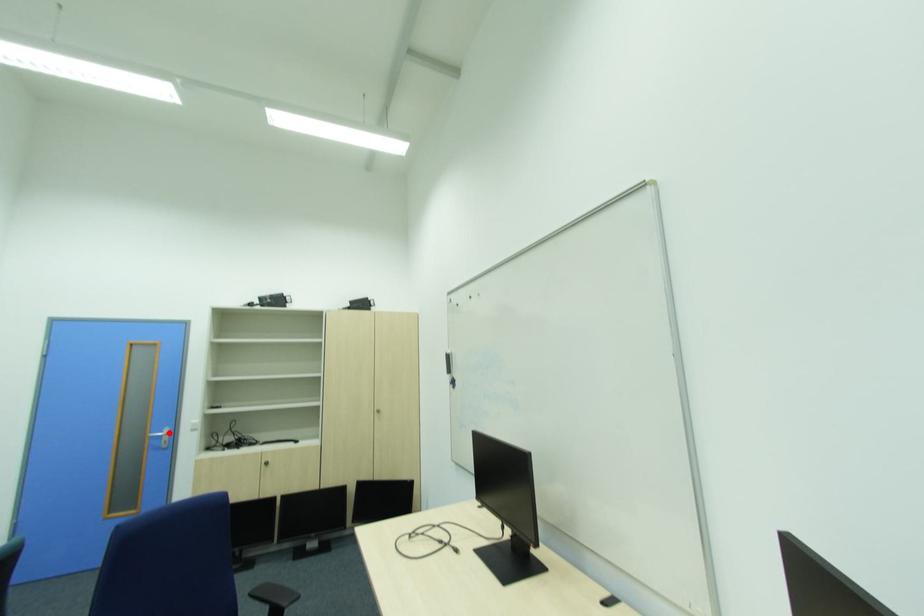
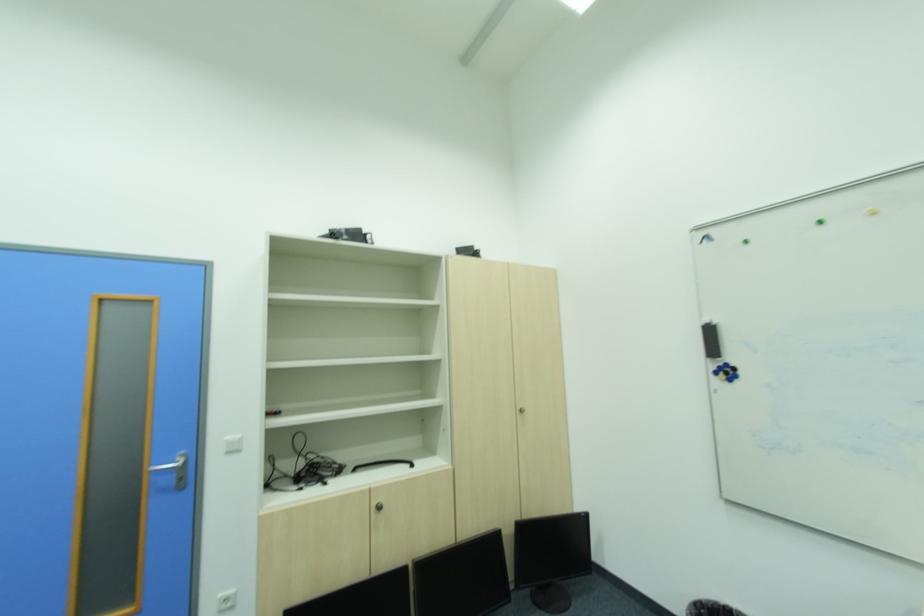
Find the pixel in the second image that matches the highlighted location in the first image.

(180, 463)